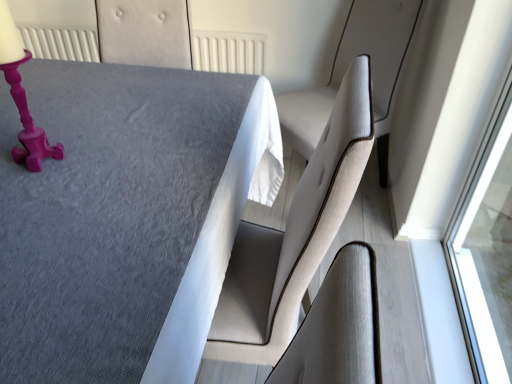
Find the location of a particular element. The width and height of the screenshot is (512, 384). textured gray table at center is located at coordinates pyautogui.click(x=123, y=218).

At what (x,y) coordinates should I click in order to perform the action: click on matte pink candlestick at upper left. Please return your answer as a coordinate pair (x, y). Looking at the image, I should click on (22, 96).

Where is `textured gray table at center`? The height and width of the screenshot is (384, 512). textured gray table at center is located at coordinates (123, 218).

Identify the location of table below the light beige fabric swivel chair at right (from the image's perspective). The height and width of the screenshot is (384, 512). (123, 218).

In the scene shown: Who is shorter, light beige fabric swivel chair at right or textured gray table at center?

With less height is light beige fabric swivel chair at right.

Is light beige fabric swivel chair at right not within textured gray table at center?

Yes, light beige fabric swivel chair at right is located beyond the bounds of textured gray table at center.

How many degrees apart are the facing directions of light beige fabric swivel chair at right and textured gray table at center?

light beige fabric swivel chair at right and textured gray table at center are facing 40.5 degrees away from each other.

Does matte pink candlestick at upper left have a greater height compared to light beige fabric swivel chair at right?

No, matte pink candlestick at upper left is not taller than light beige fabric swivel chair at right.

How far apart are matte pink candlestick at upper left and light beige fabric swivel chair at right?

matte pink candlestick at upper left is 1.26 meters away from light beige fabric swivel chair at right.

Considering the relative sizes of matte pink candlestick at upper left and light beige fabric swivel chair at right in the image provided, is matte pink candlestick at upper left bigger than light beige fabric swivel chair at right?

Actually, matte pink candlestick at upper left might be smaller than light beige fabric swivel chair at right.

Can you confirm if matte pink candlestick at upper left is wider than light beige fabric swivel chair at right?

In fact, matte pink candlestick at upper left might be narrower than light beige fabric swivel chair at right.

Is matte pink candlestick at upper left positioned far away from textured gray table at center?

No, there isn't a large distance between matte pink candlestick at upper left and textured gray table at center.

Find the location of a particular element. This screenshot has width=512, height=384. table lamp that appears behind the textured gray table at center is located at coordinates (22, 96).

Who is taller, matte pink candlestick at upper left or textured gray table at center?

Standing taller between the two is textured gray table at center.

Which is behind, point (2, 34) or point (32, 89)?

The point (32, 89) is farther.

Which object is further away from the camera, textured gray table at center or light beige fabric swivel chair at right?

light beige fabric swivel chair at right is more distant.

Is textured gray table at center facing towards light beige fabric swivel chair at right?

No, textured gray table at center is not aimed at light beige fabric swivel chair at right.

Is textured gray table at center situated inside light beige fabric swivel chair at right or outside?

textured gray table at center cannot be found inside light beige fabric swivel chair at right.

From the image's perspective, which object appears higher, textured gray table at center or matte pink candlestick at upper left?

matte pink candlestick at upper left.

Does textured gray table at center turn towards matte pink candlestick at upper left?

Yes, textured gray table at center is oriented towards matte pink candlestick at upper left.

From their relative heights in the image, would you say textured gray table at center is taller or shorter than matte pink candlestick at upper left?

In the image, textured gray table at center appears to be taller than matte pink candlestick at upper left.

Is textured gray table at center not inside matte pink candlestick at upper left?

Yes, textured gray table at center is located beyond the bounds of matte pink candlestick at upper left.

Between light beige fabric swivel chair at right and matte pink candlestick at upper left, which one appears on the right side from the viewer's perspective?

light beige fabric swivel chair at right.

Is light beige fabric swivel chair at right far from matte pink candlestick at upper left?

Yes, light beige fabric swivel chair at right and matte pink candlestick at upper left are located far from each other.

Find the location of `table lamp above the light beige fabric swivel chair at right (from a real-world perspective)`. table lamp above the light beige fabric swivel chair at right (from a real-world perspective) is located at coordinates (22, 96).

Locate an element on the screen. Image resolution: width=512 pixels, height=384 pixels. table above the light beige fabric swivel chair at right (from a real-world perspective) is located at coordinates (123, 218).

This screenshot has width=512, height=384. What are the coordinates of `table lamp lying below the light beige fabric swivel chair at right (from the image's perspective)` in the screenshot? It's located at (22, 96).

Looking at the image, which one is located closer to textured gray table at center, matte pink candlestick at upper left or light beige fabric swivel chair at right?

Among the two, matte pink candlestick at upper left is located nearer to textured gray table at center.

Which object lies nearer to the anchor point light beige fabric swivel chair at right, textured gray table at center or matte pink candlestick at upper left?

textured gray table at center is positioned closer to the anchor light beige fabric swivel chair at right.

Considering their positions, is textured gray table at center positioned further to matte pink candlestick at upper left than light beige fabric swivel chair at right?

light beige fabric swivel chair at right lies further to matte pink candlestick at upper left than the other object.

Which object lies nearer to the anchor point matte pink candlestick at upper left, light beige fabric swivel chair at right or textured gray table at center?

textured gray table at center.

Based on the photo, looking at the image, which one is located further to textured gray table at center, light beige fabric swivel chair at right or matte pink candlestick at upper left?

light beige fabric swivel chair at right is further to textured gray table at center.

Estimate the real-world distances between objects in this image. Which object is further from light beige fabric swivel chair at right, matte pink candlestick at upper left or textured gray table at center?

matte pink candlestick at upper left.

At what (x,y) coordinates should I click in order to perform the action: click on table between matte pink candlestick at upper left and light beige fabric swivel chair at right. Please return your answer as a coordinate pair (x, y). Looking at the image, I should click on (123, 218).